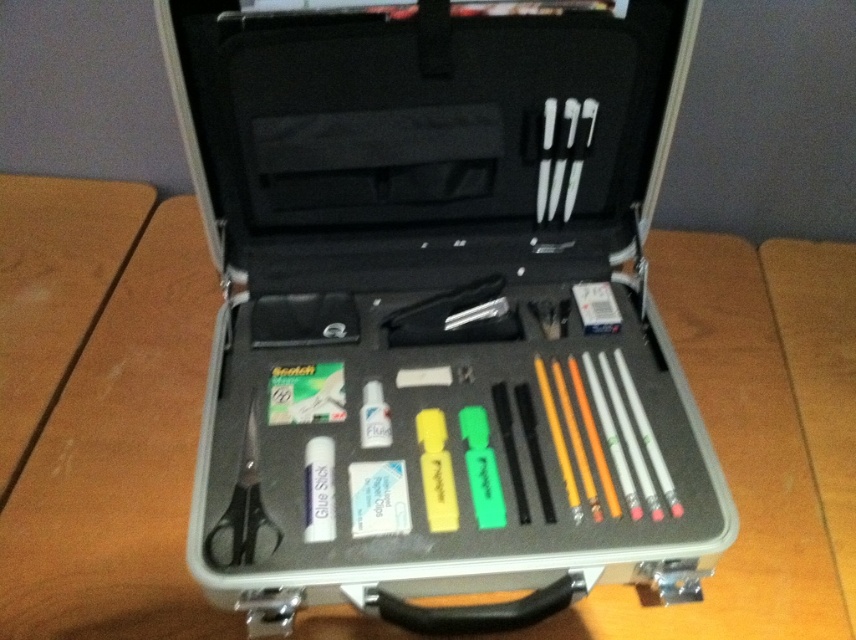
You are organizing your desk and need to place a new pen. You have a silver metallic briefcase at center and a white plastic eraser at center. Which object should you place the pen closer to if you want it to be more accessible from your current position?

You should place the pen closer to the silver metallic briefcase at center because it is closer to you than the white plastic eraser at center, making it more accessible.

You are trying to reach for the white plastic screwdriver at upper right while standing in front of the silver metallic briefcase at center. Which object is closer to your hand?

The silver metallic briefcase at center is closer to your hand since it is closer to the viewer than the white plastic screwdriver at upper right.